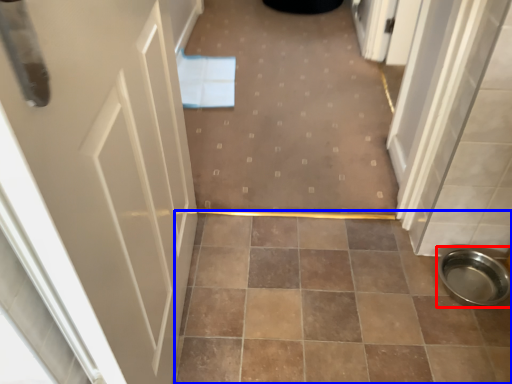
Question: Which object is further to the camera taking this photo, toilet bowl (highlighted by a red box) or ceramic tile (highlighted by a blue box)?

Choices:
 (A) toilet bowl
 (B) ceramic tile

Answer: (A)